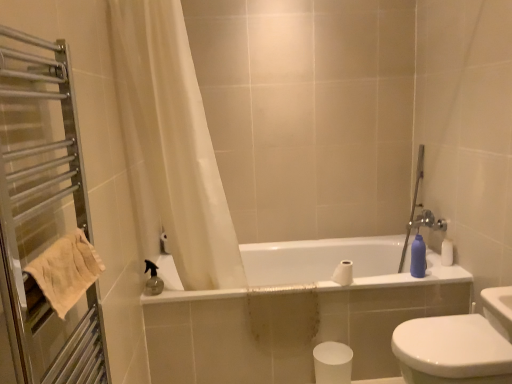
Measure the distance between white matte toilet paper at lower center, the 2th toilet paper when ordered from top to bottom, and camera.

white matte toilet paper at lower center, the 2th toilet paper when ordered from top to bottom, and camera are 6.64 feet apart.

This screenshot has width=512, height=384. What do you see at coordinates (46, 220) in the screenshot?
I see `metal towel rack at left` at bounding box center [46, 220].

What do you see at coordinates (452, 350) in the screenshot? I see `white glossy bidet at lower right` at bounding box center [452, 350].

This screenshot has height=384, width=512. Identify the location of white glossy bathtub at center. [297, 313].

This screenshot has width=512, height=384. Describe the element at coordinates (297, 313) in the screenshot. I see `white glossy bathtub at center` at that location.

Image resolution: width=512 pixels, height=384 pixels. Find the location of `white matte toilet paper at center, acting as the first toilet paper starting from the top`. white matte toilet paper at center, acting as the first toilet paper starting from the top is located at coordinates [x=343, y=273].

This screenshot has width=512, height=384. Describe the element at coordinates (343, 273) in the screenshot. I see `white matte toilet paper at center, marked as the second toilet paper in a bottom-to-top arrangement` at that location.

The height and width of the screenshot is (384, 512). What do you see at coordinates (170, 143) in the screenshot? I see `white sheer curtain at upper left` at bounding box center [170, 143].

This screenshot has width=512, height=384. Identify the location of beige cotton towel at left. (66, 270).

Where is `white matte toilet paper at lower center, which appears as the first toilet paper when ordered from the bottom`? This screenshot has height=384, width=512. white matte toilet paper at lower center, which appears as the first toilet paper when ordered from the bottom is located at coordinates (333, 363).

Which object is positioned more to the right, white glossy bidet at lower right or white matte toilet paper at center, acting as the first toilet paper starting from the top?

white glossy bidet at lower right is more to the right.

Which object is thinner, white glossy bidet at lower right or white matte toilet paper at center, acting as the first toilet paper starting from the top?

Thinner between the two is white matte toilet paper at center, acting as the first toilet paper starting from the top.

Is the depth of white glossy bidet at lower right greater than that of white matte toilet paper at center, marked as the second toilet paper in a bottom-to-top arrangement?

No, white glossy bidet at lower right is closer to the viewer.

From a real-world perspective, relative to white matte toilet paper at center, marked as the second toilet paper in a bottom-to-top arrangement, is white glossy bidet at lower right vertically above or below?

From a real-world perspective, white glossy bidet at lower right is physically below white matte toilet paper at center, marked as the second toilet paper in a bottom-to-top arrangement.

Which object is further away from the camera taking this photo, white glossy bathtub at center or metal towel rack at left?

white glossy bathtub at center.

Considering the sizes of white glossy bathtub at center and metal towel rack at left in the image, is white glossy bathtub at center taller or shorter than metal towel rack at left?

white glossy bathtub at center is shorter than metal towel rack at left.

From the picture: From the image's perspective, which object appears higher, white glossy bathtub at center or metal towel rack at left?

Result: From the image's view, metal towel rack at left is above.

Which of these two, white glossy bathtub at center or metal towel rack at left, is bigger?

Bigger between the two is white glossy bathtub at center.

Does beige cotton towel at left turn towards matte plastic bottle at right?

No, beige cotton towel at left is not facing towards matte plastic bottle at right.

Is beige cotton towel at left not near matte plastic bottle at right?

Yes, beige cotton towel at left and matte plastic bottle at right are located far from each other.

Does beige cotton towel at left have a greater height compared to matte plastic bottle at right?

No.

Consider the image. From the image's perspective, which is below, beige cotton towel at left or matte plastic bottle at right?

matte plastic bottle at right is shown below in the image.

Is beige cotton towel at left in front of white sheer curtain at upper left?

Yes, it is.

At what (x,y) coordinates should I click in order to perform the action: click on curtain behind the beige cotton towel at left. Please return your answer as a coordinate pair (x, y). Looking at the image, I should click on (170, 143).

Is beige cotton towel at left aimed at white sheer curtain at upper left?

No, beige cotton towel at left is not turned towards white sheer curtain at upper left.

Is beige cotton towel at left far from white sheer curtain at upper left?

No.

Is point (62, 241) farther from camera compared to point (343, 274)?

No.

Can you tell me how much beige cotton towel at left and white matte toilet paper at center, marked as the second toilet paper in a bottom-to-top arrangement, differ in facing direction?

There is a 89.2-degree angle between the facing directions of beige cotton towel at left and white matte toilet paper at center, marked as the second toilet paper in a bottom-to-top arrangement.

Is beige cotton towel at left to the left or to the right of white matte toilet paper at center, marked as the second toilet paper in a bottom-to-top arrangement, in the image?

In the image, beige cotton towel at left appears on the left side of white matte toilet paper at center, marked as the second toilet paper in a bottom-to-top arrangement.

Is the depth of beige cotton towel at left greater than that of white matte toilet paper at center, marked as the second toilet paper in a bottom-to-top arrangement?

No, beige cotton towel at left is closer to the camera.

Can you confirm if white matte toilet paper at center, acting as the first toilet paper starting from the top, is positioned to the left of beige cotton towel at left?

Incorrect, white matte toilet paper at center, acting as the first toilet paper starting from the top, is not on the left side of beige cotton towel at left.

How different are the orientations of white matte toilet paper at center, marked as the second toilet paper in a bottom-to-top arrangement, and beige cotton towel at left in degrees?

The angular difference between white matte toilet paper at center, marked as the second toilet paper in a bottom-to-top arrangement, and beige cotton towel at left is 89.2 degrees.

Between white matte toilet paper at center, acting as the first toilet paper starting from the top, and beige cotton towel at left, which one is positioned in front?

beige cotton towel at left.

From the picture: Between metal towel rack at left and beige cotton towel at left, which one appears on the right side from the viewer's perspective?

Positioned to the right is beige cotton towel at left.

Does metal towel rack at left have a lesser height compared to beige cotton towel at left?

In fact, metal towel rack at left may be taller than beige cotton towel at left.

From a real-world perspective, is metal towel rack at left positioned above or below beige cotton towel at left?

From a real-world perspective, metal towel rack at left is physically above beige cotton towel at left.

Does metal towel rack at left have a lesser width compared to beige cotton towel at left?

Incorrect, the width of metal towel rack at left is not less than that of beige cotton towel at left.

I want to click on toilet paper that appears above the white glossy bidet at lower right (from the image's perspective), so click(x=343, y=273).

Image resolution: width=512 pixels, height=384 pixels. In order to click on bathtub behind the metal towel rack at left in this screenshot , I will do `click(297, 313)`.

Based on their spatial positions, is beige cotton towel at left or white matte toilet paper at center, acting as the first toilet paper starting from the top, closer to white glossy bidet at lower right?

white matte toilet paper at center, acting as the first toilet paper starting from the top, is positioned closer to the anchor white glossy bidet at lower right.

Considering their positions, is white sheer curtain at upper left positioned closer to white glossy bathtub at center than metal towel rack at left?

white sheer curtain at upper left is closer to white glossy bathtub at center.

When comparing their distances from beige cotton towel at left, does white sheer curtain at upper left or white matte toilet paper at lower center, the 2th toilet paper when ordered from top to bottom, seem closer?

white sheer curtain at upper left is positioned closer to the anchor beige cotton towel at left.

Based on their spatial positions, is beige cotton towel at left or white glossy bidet at lower right further from white matte toilet paper at center, marked as the second toilet paper in a bottom-to-top arrangement?

beige cotton towel at left is further to white matte toilet paper at center, marked as the second toilet paper in a bottom-to-top arrangement.

When comparing their distances from matte plastic bottle at right, does white glossy bathtub at center or metal towel rack at left seem closer?

Based on the image, white glossy bathtub at center appears to be nearer to matte plastic bottle at right.

Estimate the real-world distances between objects in this image. Which object is closer to matte plastic bottle at right, white glossy bidet at lower right or white matte toilet paper at lower center, which appears as the first toilet paper when ordered from the bottom?

white glossy bidet at lower right.

Which object lies nearer to the anchor point beige cotton towel at left, white glossy bathtub at center or metal towel rack at left?

metal towel rack at left is closer to beige cotton towel at left.

Considering their positions, is beige cotton towel at left positioned closer to metal towel rack at left than matte plastic bottle at right?

beige cotton towel at left is positioned closer to the anchor metal towel rack at left.

I want to click on curtain between metal towel rack at left and matte plastic bottle at right in the front-back direction, so (x=170, y=143).

Identify the location of toilet paper located between metal towel rack at left and white glossy bathtub at center in the depth direction. (333, 363).

What are the coordinates of `toilet paper located between beige cotton towel at left and white matte toilet paper at center, acting as the first toilet paper starting from the top, in the depth direction` in the screenshot? It's located at (333, 363).

Locate an element on the screen. This screenshot has width=512, height=384. towel/napkin between metal towel rack at left and matte plastic bottle at right in the front-back direction is located at coordinates [x=66, y=270].